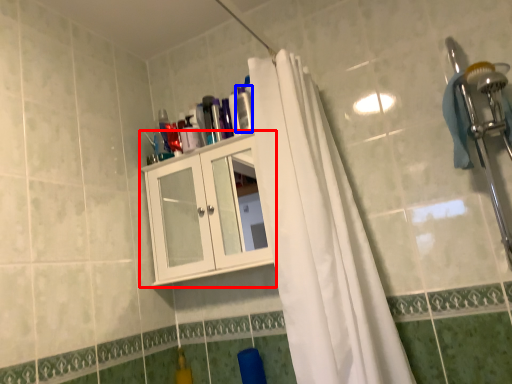
Question: Which object appears farthest to the camera in this image, cabinetry (highlighted by a red box) or toiletry (highlighted by a blue box)?

Choices:
 (A) cabinetry
 (B) toiletry

Answer: (B)